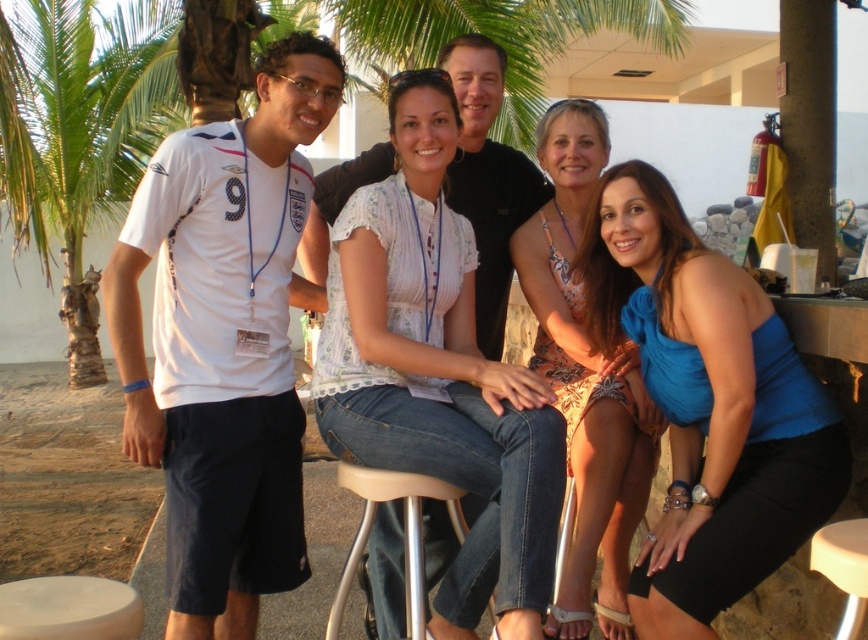
Question: Does white jersey at left lie in front of white jersey at center?

Choices:
 (A) no
 (B) yes

Answer: (B)

Question: Among these points, which one is nearest to the camera?

Choices:
 (A) (542, 184)
 (B) (372, 490)

Answer: (B)

Question: Considering the real-world distances, which object is farthest from the white lace blouse at center?

Choices:
 (A) green leafy palm tree at left
 (B) blue satin dress at lower right
 (C) white jersey at center

Answer: (A)

Question: Does white jersey at left have a lesser width compared to white jersey at center?

Choices:
 (A) yes
 (B) no

Answer: (B)

Question: Which of the following is the farthest from the observer?

Choices:
 (A) green leafy palm tree at left
 (B) white jersey at center
 (C) beige plastic stool at center
 (D) printed fabric dress at center

Answer: (A)

Question: Does green leafy palm tree at left have a larger size compared to beige plastic bar stool at lower right?

Choices:
 (A) yes
 (B) no

Answer: (A)